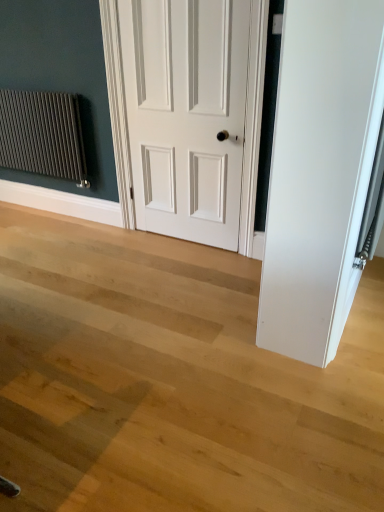
Question: Does point (64, 109) appear closer or farther from the camera than point (178, 234)?

Choices:
 (A) closer
 (B) farther

Answer: (A)

Question: Looking at the image, does matte dark gray radiator at left seem bigger or smaller compared to white matte door at center?

Choices:
 (A) big
 (B) small

Answer: (B)

Question: Do you think matte dark gray radiator at left is within white matte door at center, or outside of it?

Choices:
 (A) inside
 (B) outside

Answer: (B)

Question: Considering the positions of white matte door at center and matte dark gray radiator at left in the image, is white matte door at center bigger or smaller than matte dark gray radiator at left?

Choices:
 (A) big
 (B) small

Answer: (A)

Question: Is white matte door at center to the left or to the right of matte dark gray radiator at left in the image?

Choices:
 (A) left
 (B) right

Answer: (B)

Question: Is point (127, 53) positioned closer to the camera than point (57, 126)?

Choices:
 (A) closer
 (B) farther

Answer: (A)

Question: Is white matte door at center inside the boundaries of matte dark gray radiator at left, or outside?

Choices:
 (A) inside
 (B) outside

Answer: (B)